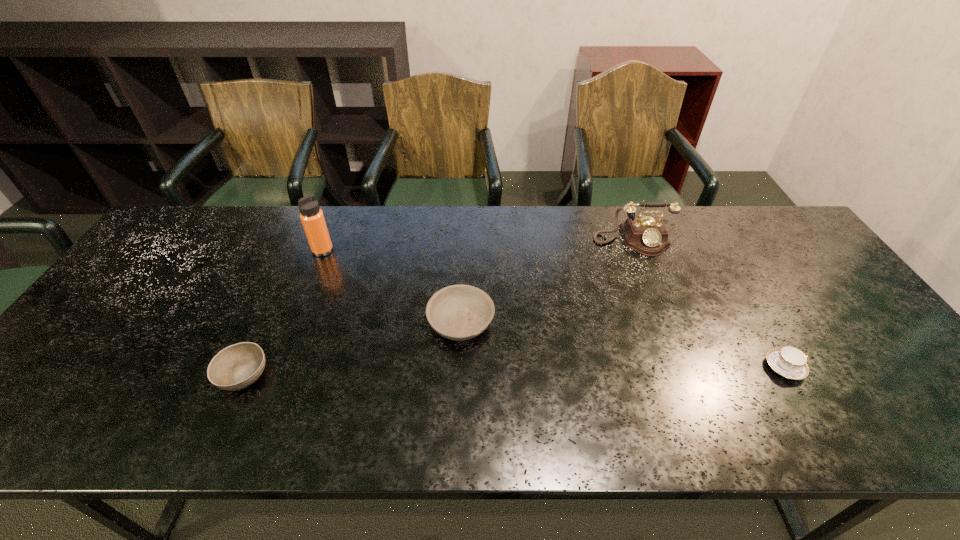
Find the location of `object identified as the third closest to the left bowl`. object identified as the third closest to the left bowl is located at coordinates (647, 235).

Identify the location of object that is the closest to the telephone. (789, 362).

You are a GUI agent. You are given a task and a screenshot of the screen. Output one action in this format:
    pyautogui.click(x=<x>, y=<y>)
    Task: Click on the free space that satisfies the following two spatial constraints: 1. on the side with the handle of the rightmost object; 2. on the front side of the left bowl
    The image size is (960, 540).
    Given the screenshot: What is the action you would take?
    pyautogui.click(x=789, y=375)

Find the location of `free region that satisfies the following two spatial constraints: 1. on the back side of the nearer bowl; 2. on the left side of the right bowl`. free region that satisfies the following two spatial constraints: 1. on the back side of the nearer bowl; 2. on the left side of the right bowl is located at coordinates (267, 322).